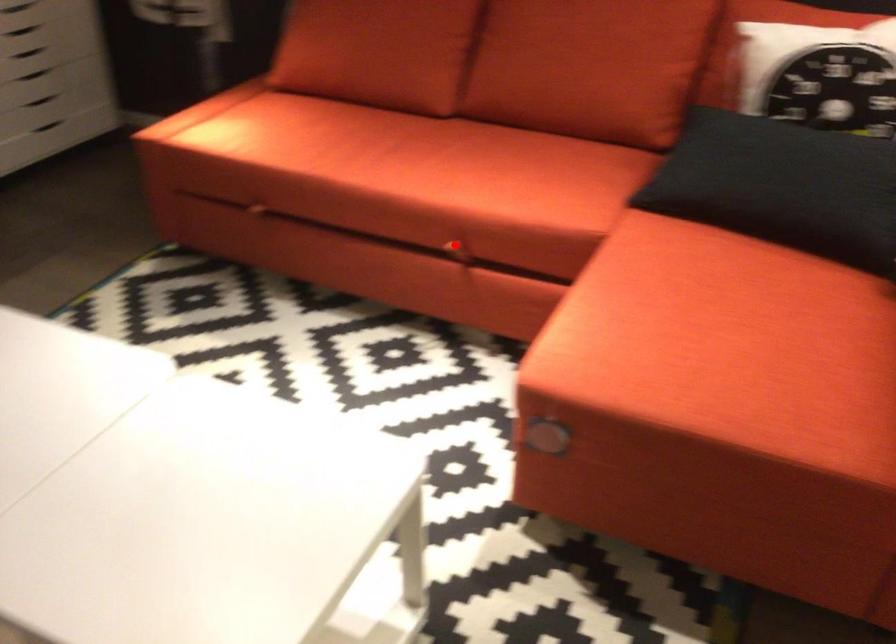
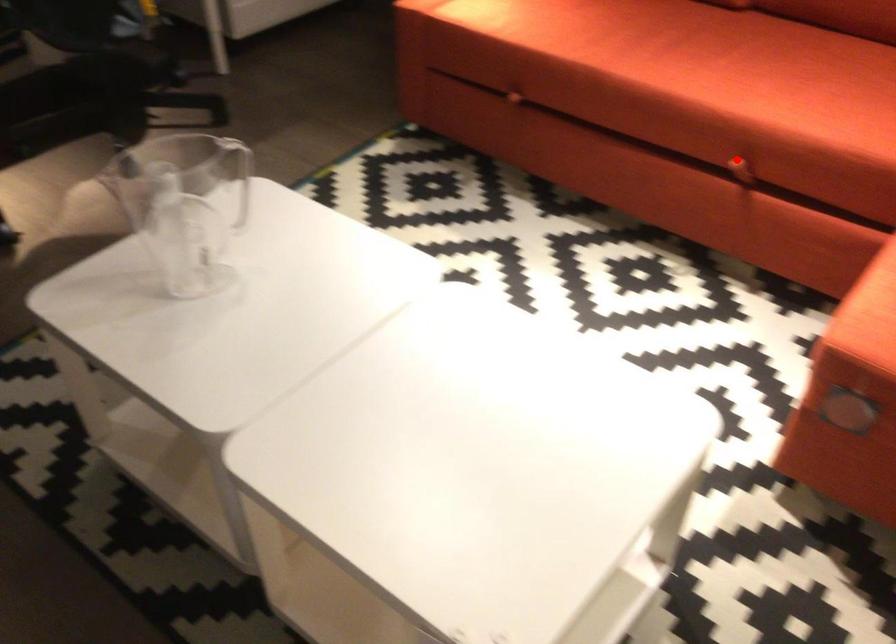
I am providing you with two images of the same scene from different viewpoints. A red point is marked on the first image and another point is marked on the second image. Do the highlighted points in image1 and image2 indicate the same real-world spot?

Yes